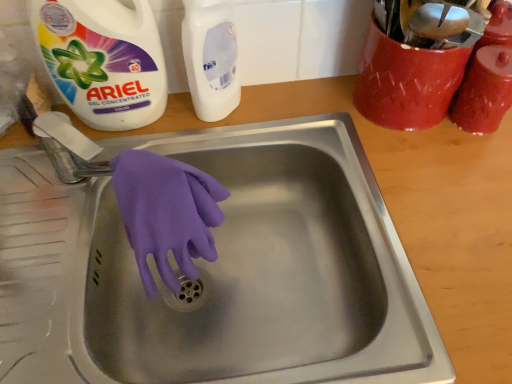
Question: In terms of height, does stainless steel sink at center look taller or shorter compared to purple rubber glove at sink center?

Choices:
 (A) tall
 (B) short

Answer: (B)

Question: Does point (429, 362) appear closer or farther from the camera than point (202, 180)?

Choices:
 (A) farther
 (B) closer

Answer: (B)

Question: Which of these objects is positioned closest to the matte red jar at upper right, the third cleaning product positioned from the left?

Choices:
 (A) white gel concentrated at upper left, placed as the 3th cleaning product when sorted from right to left
 (B) purple rubber glove at sink center
 (C) white matte bottle at upper center, acting as the 2th cleaning product starting from the left
 (D) stainless steel sink at center

Answer: (C)

Question: Estimate the real-world distances between objects in this image. Which object is farther from the white matte bottle at upper center, which ranks as the 2th cleaning product in right-to-left order?

Choices:
 (A) purple rubber glove at sink center
 (B) stainless steel sink at center
 (C) matte red jar at upper right, which is the 1th cleaning product from right to left
 (D) white gel concentrated at upper left, placed as the 3th cleaning product when sorted from right to left

Answer: (C)